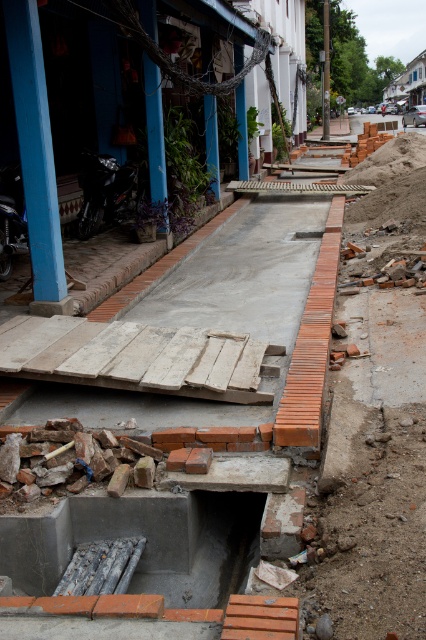
Is point (155, 29) closer to viewer compared to point (324, 122)?

Yes, it is.

Between blue painted wood at upper left and brushed metal pole at center, which one is positioned lower?

blue painted wood at upper left

Between point (138, 4) and point (327, 51), which one is positioned in front?

Positioned in front is point (138, 4).

This screenshot has height=640, width=426. Identify the location of blue painted wood at upper left. (155, 131).

Is the position of blue painted wood at left less distant than that of blue painted wood at upper left?

Yes.

Who is higher up, blue painted wood at left or blue painted wood at upper left?

blue painted wood at upper left is above.

Is point (48, 196) positioned in front of point (164, 179)?

Yes, it is in front of point (164, 179).

Identify the location of blue painted wood at left. (36, 152).

Can you confirm if blue painted wood at left is taller than brushed metal pole at center?

In fact, blue painted wood at left may be shorter than brushed metal pole at center.

Is blue painted wood at left below brushed metal pole at center?

Indeed, blue painted wood at left is positioned under brushed metal pole at center.

This screenshot has height=640, width=426. I want to click on blue painted wood at left, so click(36, 152).

The width and height of the screenshot is (426, 640). I want to click on blue painted wood at left, so click(x=36, y=152).